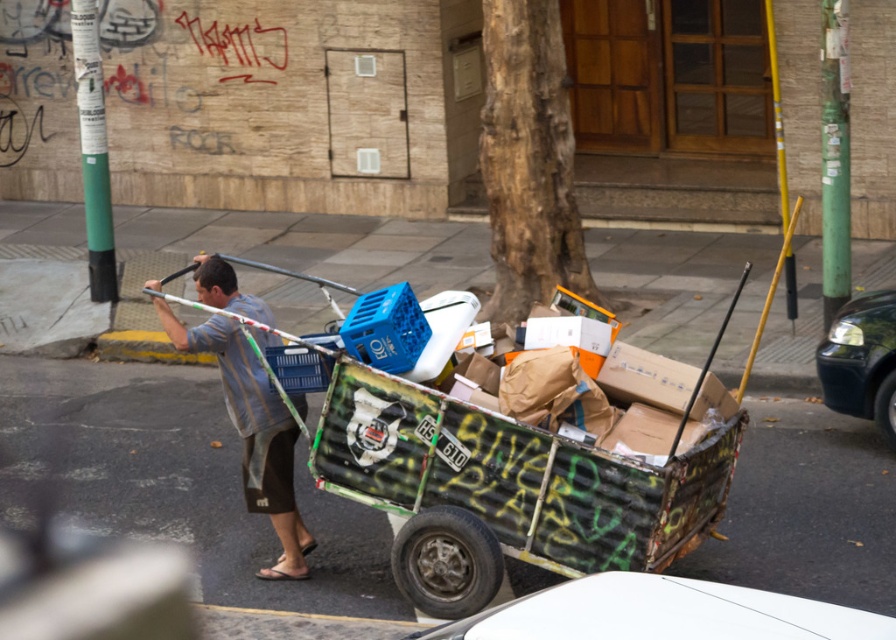
Locate an element on the screen. This screenshot has width=896, height=640. white matte car at lower center is located at coordinates (662, 612).

Locate an element on the screen. This screenshot has height=640, width=896. white matte car at lower center is located at coordinates (662, 612).

Who is more forward, [354,490] or [302,404]?

Point [354,490]

Does rusty corrugated cart at center appear on the left side of striped fabric shirt at center?

Incorrect, rusty corrugated cart at center is not on the left side of striped fabric shirt at center.

The image size is (896, 640). What are the coordinates of `rusty corrugated cart at center` in the screenshot? It's located at (498, 486).

Can you confirm if rusty corrugated cart at center is positioned to the left of white matte car at lower center?

Correct, you'll find rusty corrugated cart at center to the left of white matte car at lower center.

Describe the element at coordinates (498, 486) in the screenshot. I see `rusty corrugated cart at center` at that location.

I want to click on rusty corrugated cart at center, so click(x=498, y=486).